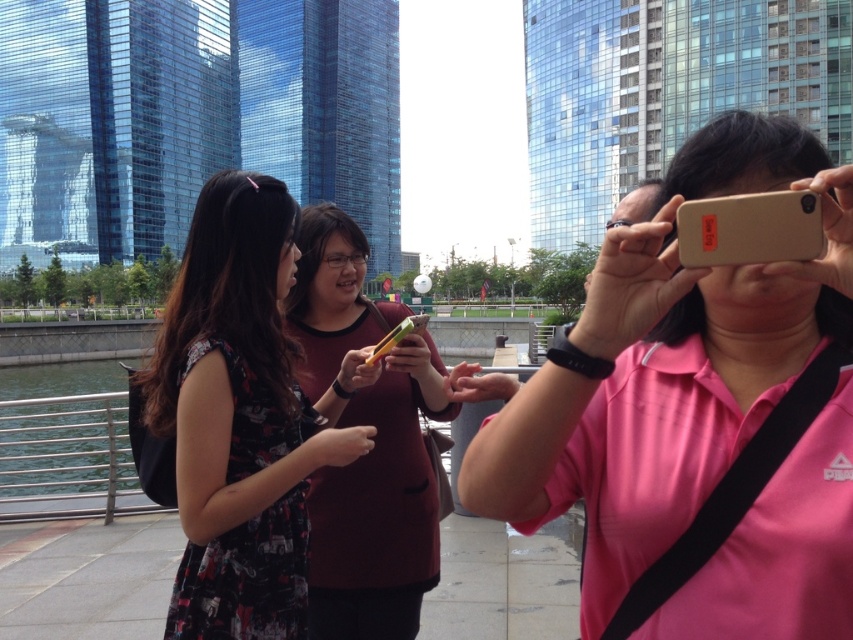
You are trying to take a photo of the maroon fabric shirt at center without including the matte gold phone at center in the frame. Based on their positions, is this possible?

The matte gold phone at center is to the right of the maroon fabric shirt at center, so if you position your camera to the left side of the maroon fabric shirt at center, you can capture it without the phone appearing in the shot.